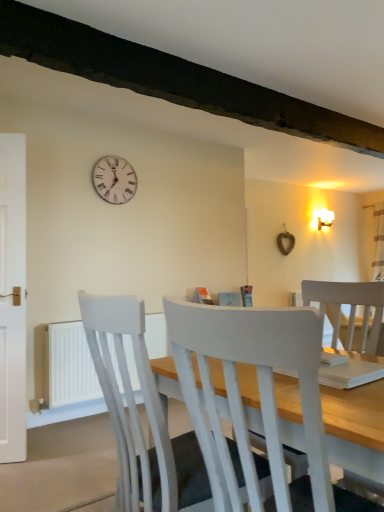
Question: From a real-world perspective, is white wooden clock at upper center under white painted wood chair at center, marked as the first chair in a front-to-back arrangement?

Choices:
 (A) yes
 (B) no

Answer: (B)

Question: Is white wooden clock at upper center facing towards white painted wood chair at center, marked as the first chair in a front-to-back arrangement?

Choices:
 (A) yes
 (B) no

Answer: (A)

Question: Considering the relative sizes of white wooden clock at upper center and white painted wood chair at center, marked as the first chair in a front-to-back arrangement, in the image provided, is white wooden clock at upper center smaller than white painted wood chair at center, marked as the first chair in a front-to-back arrangement,?

Choices:
 (A) yes
 (B) no

Answer: (A)

Question: Is white wooden clock at upper center closer to the viewer compared to white painted wood chair at center, marked as the first chair in a front-to-back arrangement?

Choices:
 (A) no
 (B) yes

Answer: (A)

Question: Does white wooden clock at upper center have a greater width compared to white painted wood chair at center, marked as the first chair in a front-to-back arrangement?

Choices:
 (A) yes
 (B) no

Answer: (B)

Question: Is white wooden clock at upper center thinner than white painted wood chair at center, placed as the second chair when sorted from back to front?

Choices:
 (A) yes
 (B) no

Answer: (A)

Question: Is white plastic radiator at lower left thinner than white painted wood chair at center, which is the first chair in back-to-front order?

Choices:
 (A) yes
 (B) no

Answer: (A)

Question: Is white plastic radiator at lower left behind white painted wood chair at center, which is the first chair in back-to-front order?

Choices:
 (A) no
 (B) yes

Answer: (B)

Question: From the image's perspective, does white plastic radiator at lower left appear lower than white painted wood chair at center, which is the first chair in back-to-front order?

Choices:
 (A) yes
 (B) no

Answer: (A)

Question: From the image's perspective, is white plastic radiator at lower left above white painted wood chair at center, which is the first chair in back-to-front order?

Choices:
 (A) no
 (B) yes

Answer: (A)

Question: Is white plastic radiator at lower left completely or partially outside of white painted wood chair at center, which is the first chair in back-to-front order?

Choices:
 (A) yes
 (B) no

Answer: (A)

Question: Can you confirm if white plastic radiator at lower left is shorter than white painted wood chair at center, which is the first chair in back-to-front order?

Choices:
 (A) yes
 (B) no

Answer: (A)

Question: From a real-world perspective, is white painted wood chair at center, placed as the second chair when sorted from back to front, positioned under white painted wood chair at center, which is the first chair in back-to-front order, based on gravity?

Choices:
 (A) yes
 (B) no

Answer: (B)